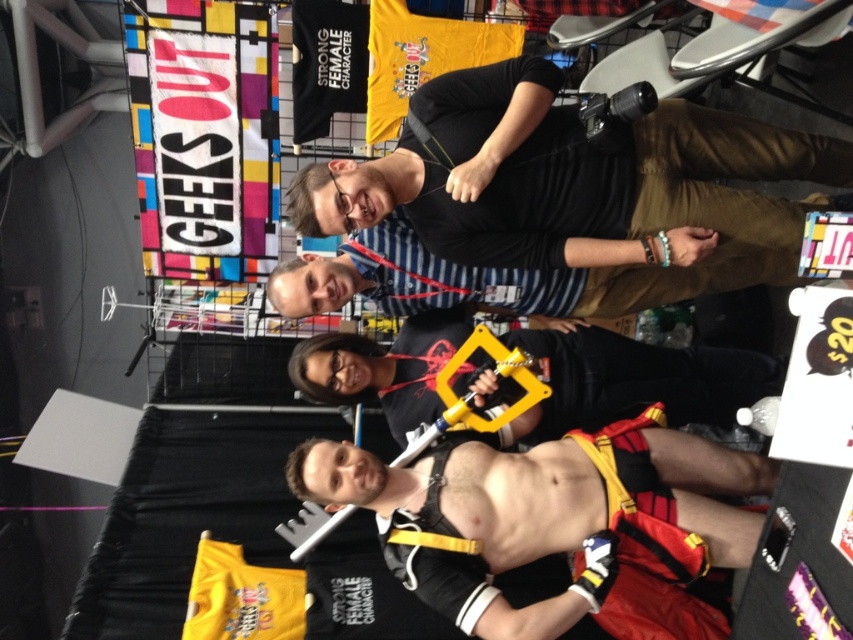
Based on the photo, you are a security guard at the event and need to determine if the black leather harness at center can be stored in a locker that is 10 cm taller than the yellow plastic handcuffs at center. Can it fit?

The black leather harness at center is taller than the yellow plastic handcuffs at center. Since the locker is 10 cm taller than the handcuffs, the harness may fit if its height difference is within the 10 cm allowance. However, without exact measurements, it is uncertain. Check the harness height against the locker dimensions.

What is the position of the point labeled as point (543, 515) in the image?

The point labeled as point (543, 515) is located on the black leather harness at center.

Where is the black leather harness at center located in the image?

The black leather harness at center is located at point (543, 515).